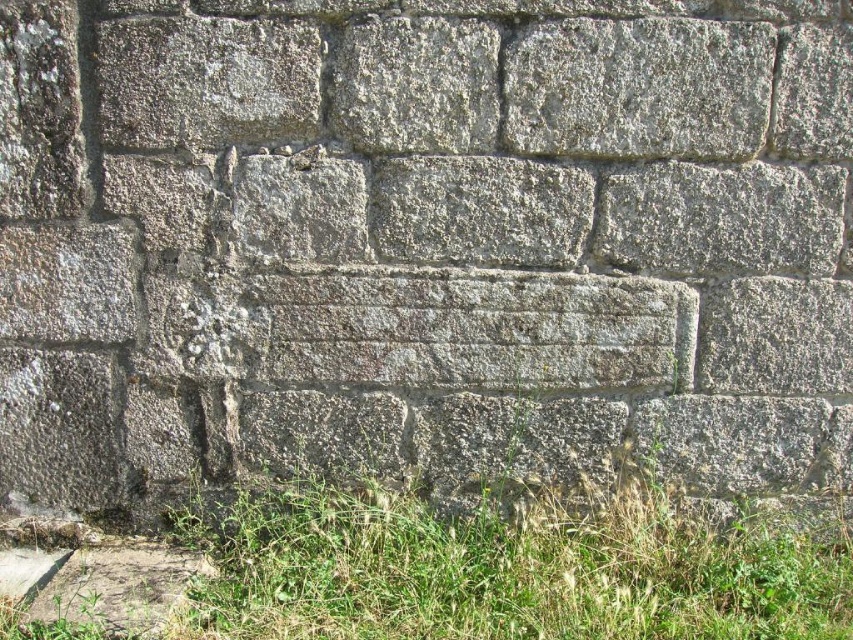
You are standing in front of a stone wall and notice green grass at lower left and gray rough stone at upper center. Which object is positioned higher up in the image?

The gray rough stone at upper center is positioned higher up in the image than the green grass at lower left.

You are standing in front of a stone wall and notice green grass at lower left and gray rough stone at upper center. Which object is located to the left of the other?

The green grass at lower left is positioned on the left side of gray rough stone at upper center, so the green grass at lower left is to the left of the gray rough stone at upper center.